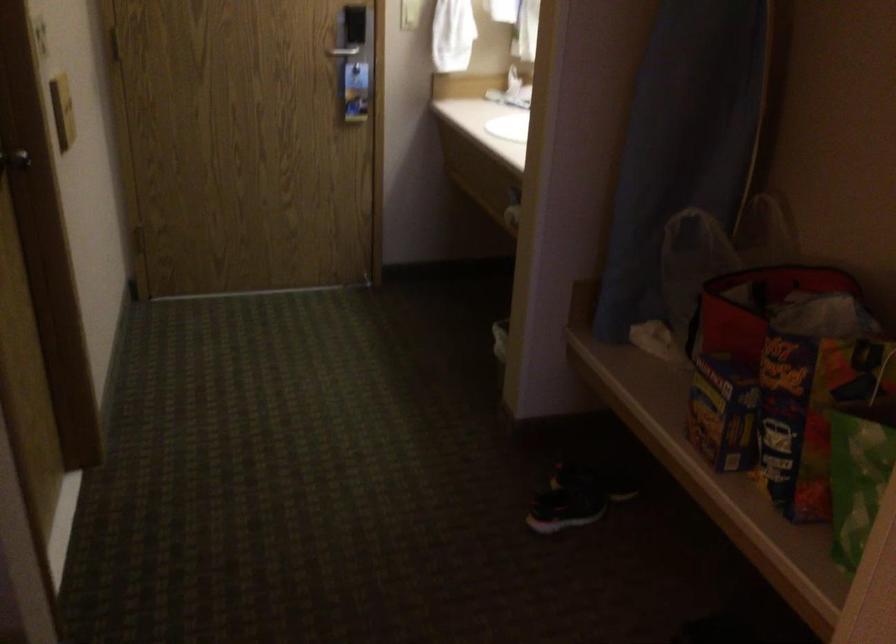
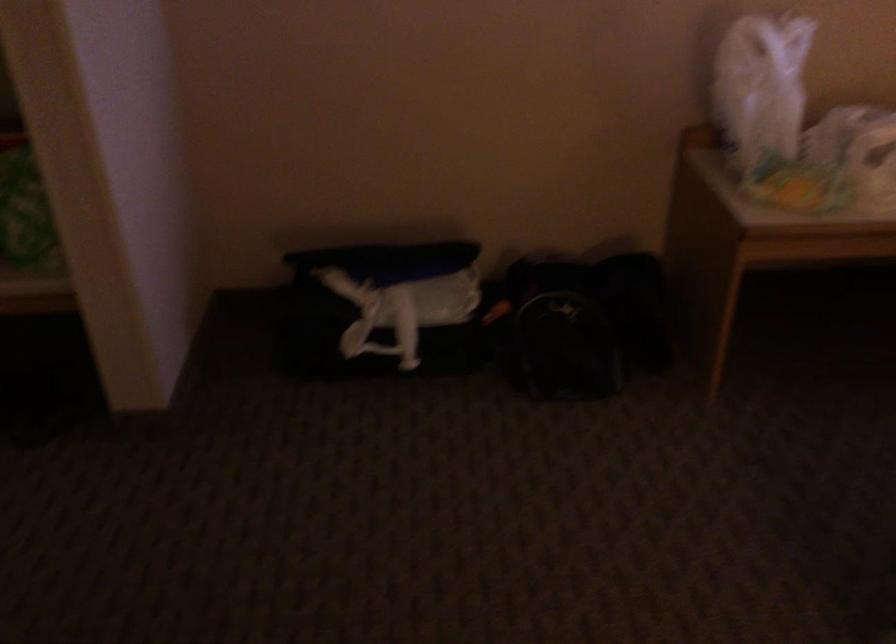
How did the camera likely rotate?

The camera's rotation is toward right-down.